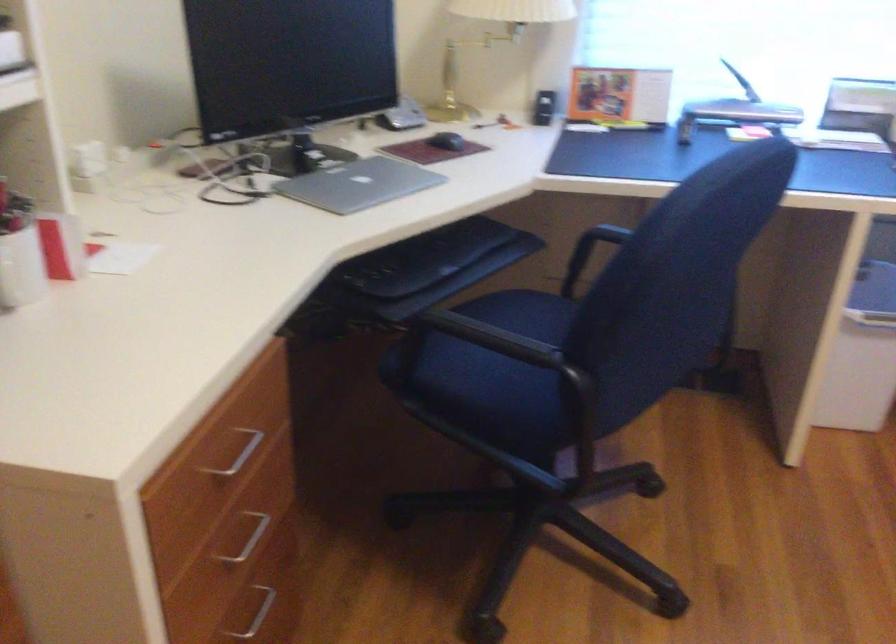
Which object does [446,140] point to?

It corresponds to the black computer mouse in the image.